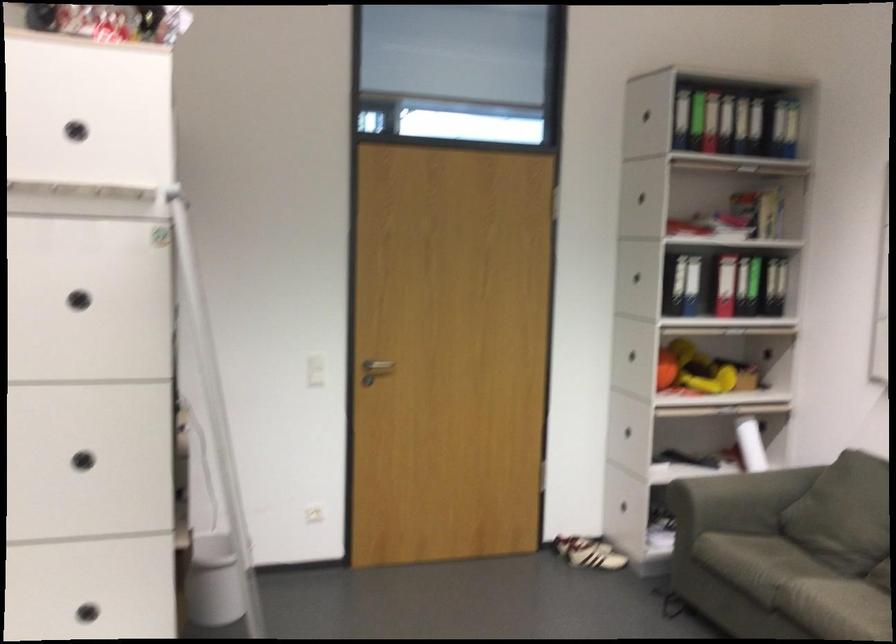
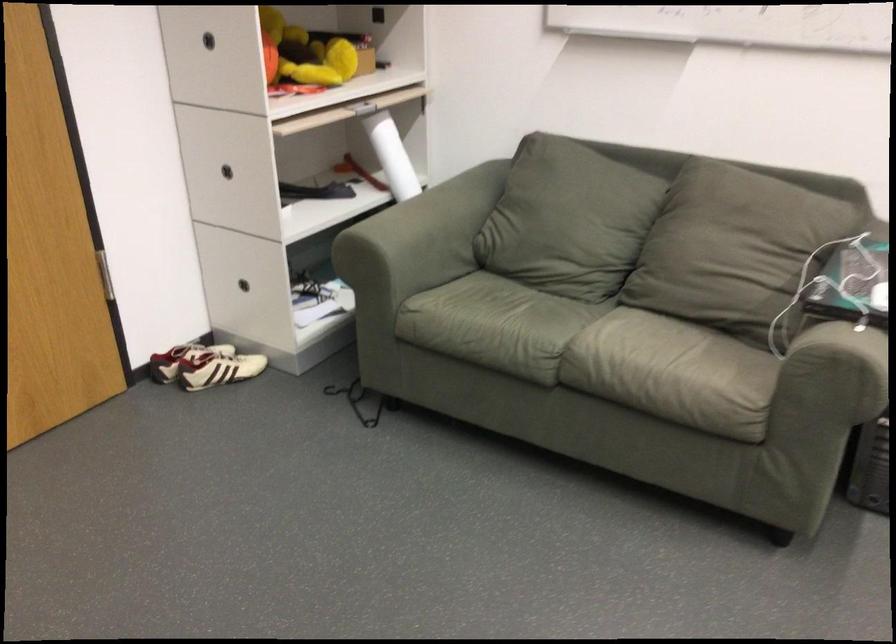
In the second image, find the point that corresponds to pixel 618 424 in the first image.

(227, 171)